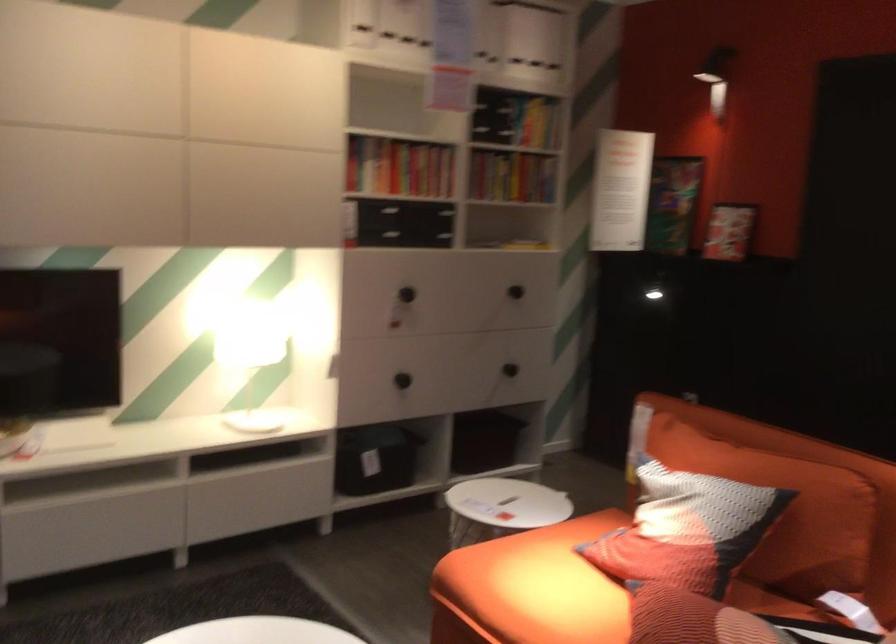
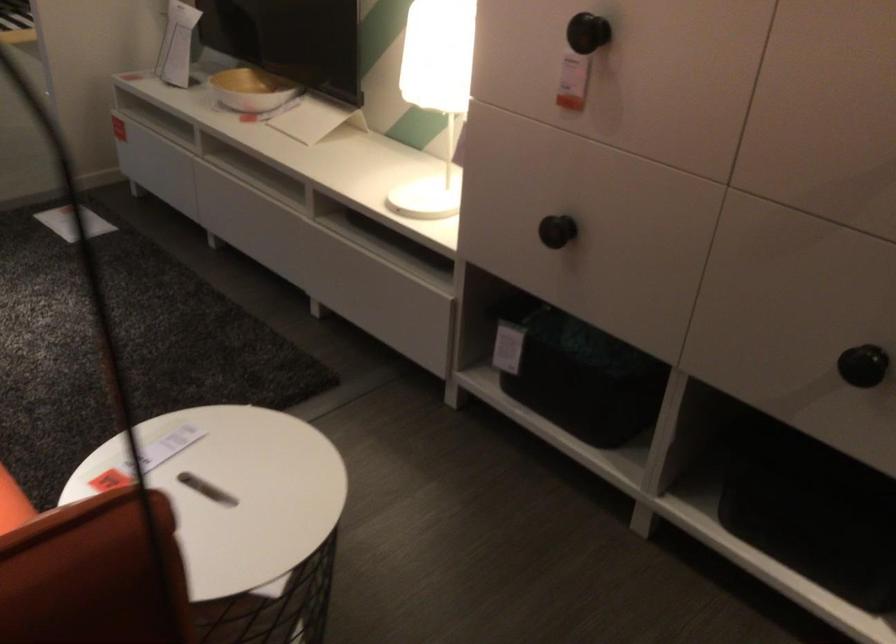
Find the pixel in the second image that matches pixel 428 368 in the first image.

(556, 231)